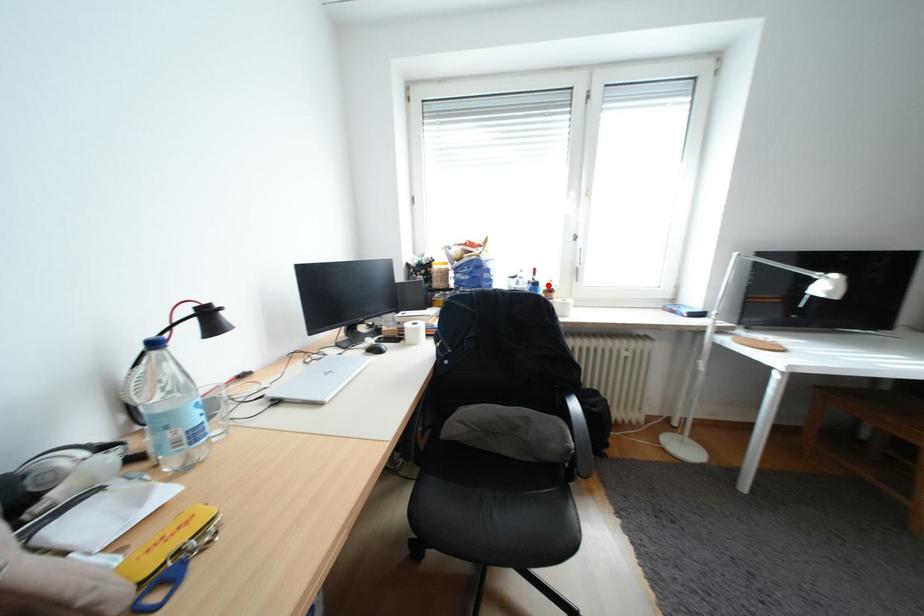
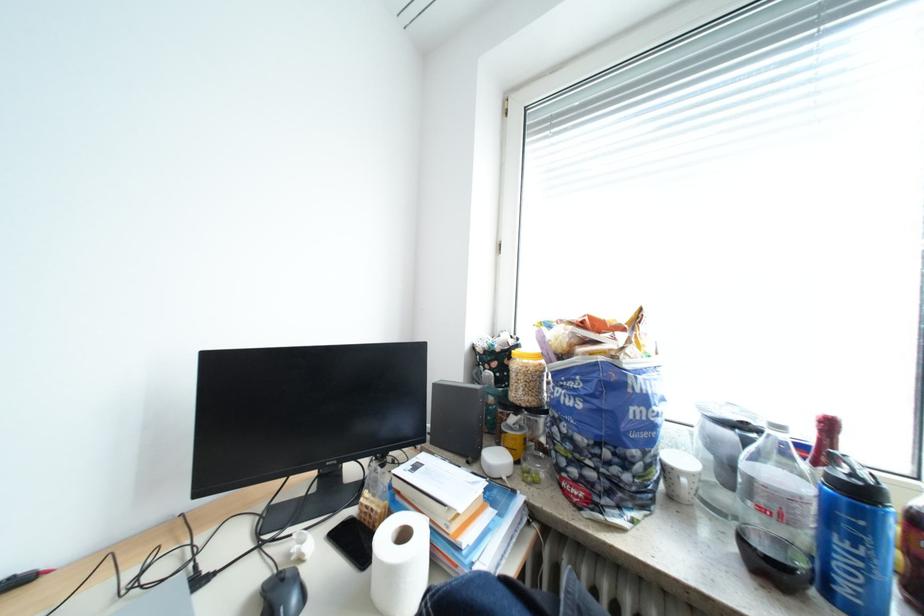
Question: A red point is marked in image1. In image2, is the corresponding 3D point closer to the camera or farther? Reply with the corresponding letter.

Choices:
 (A) The corresponding 3D point is closer.
 (B) The corresponding 3D point is farther.

Answer: (A)